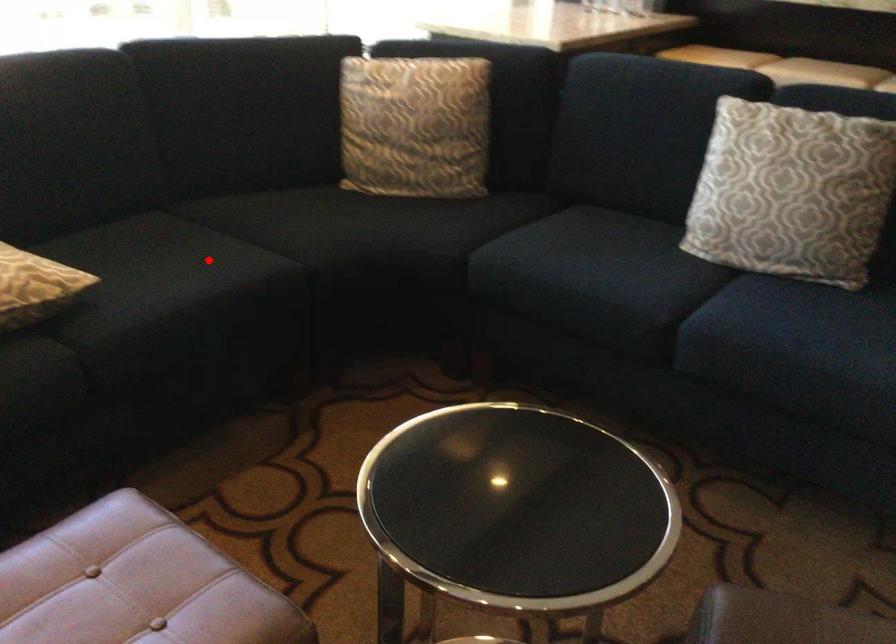
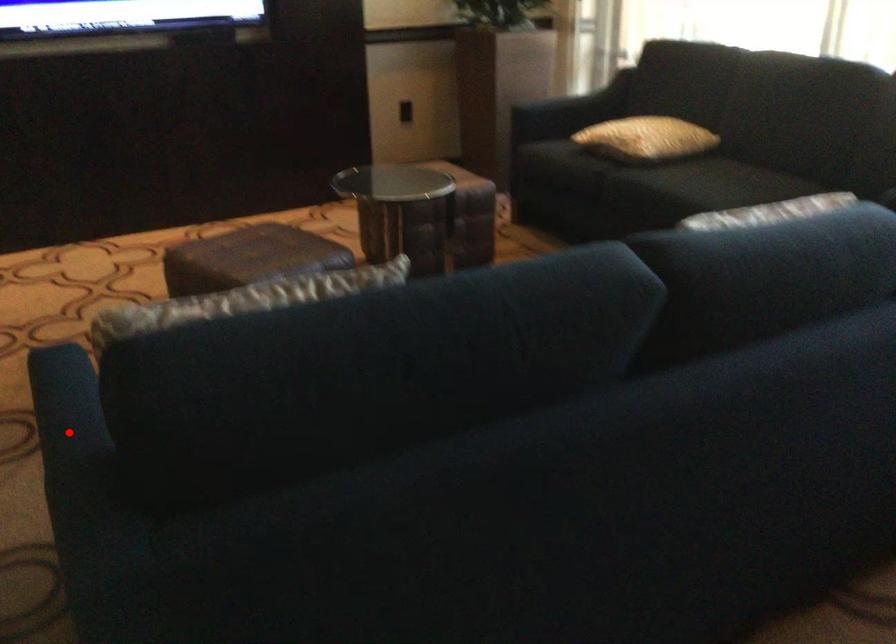
I am providing you with two images of the same scene from different viewpoints. A red point is marked on the first image and another point is marked on the second image. Is the marked point in image1 the same physical position as the marked point in image2?

No